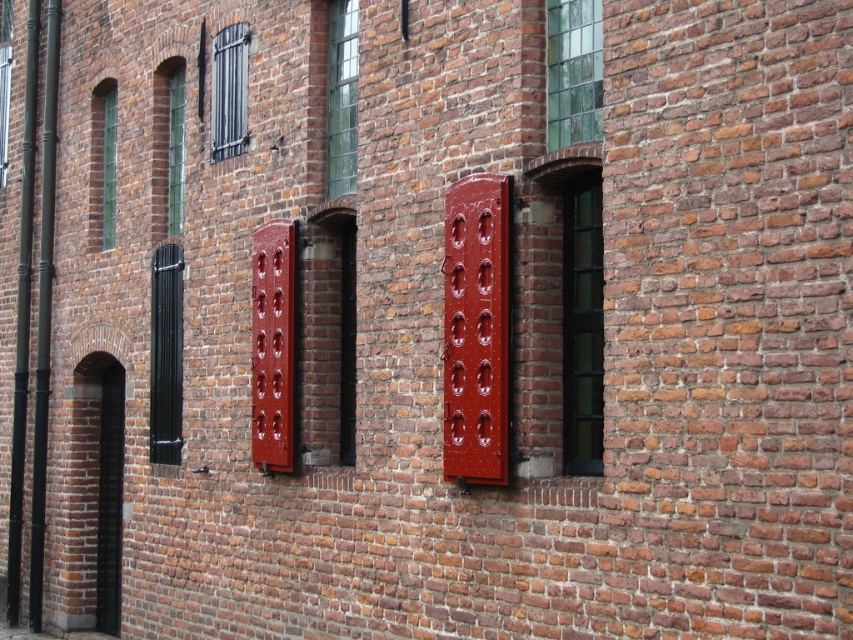
You are standing in front of the brick building and want to know which window is closer to you. The windows are the clear glass window at center right and the clear glass window at upper right. Which one is closer?

A: The clear glass window at center right is closer to you because it is further to the viewer than the clear glass window at upper right.

You are an architect inspecting the brick building. You notice the clear glass window at center right and the matte black shutters at upper left. Which of these two has a larger surface area?

The matte black shutters at upper left are larger than the clear glass window at center right according to the description provided.

You are a window installer assessing the building. You have two clear glass panes, one larger and one smaller. Which pane should you use for the clear glass window at center right and which for the clear glass window at upper right?

The clear glass window at center right requires the larger pane, while the clear glass window at upper right needs the smaller one since the clear glass window at center right is bigger than clear glass window at upper right.